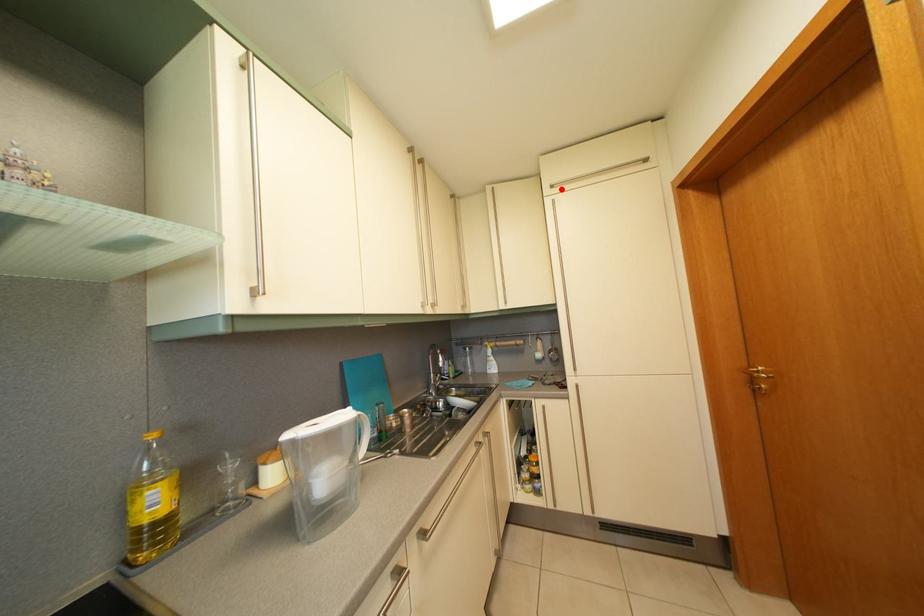
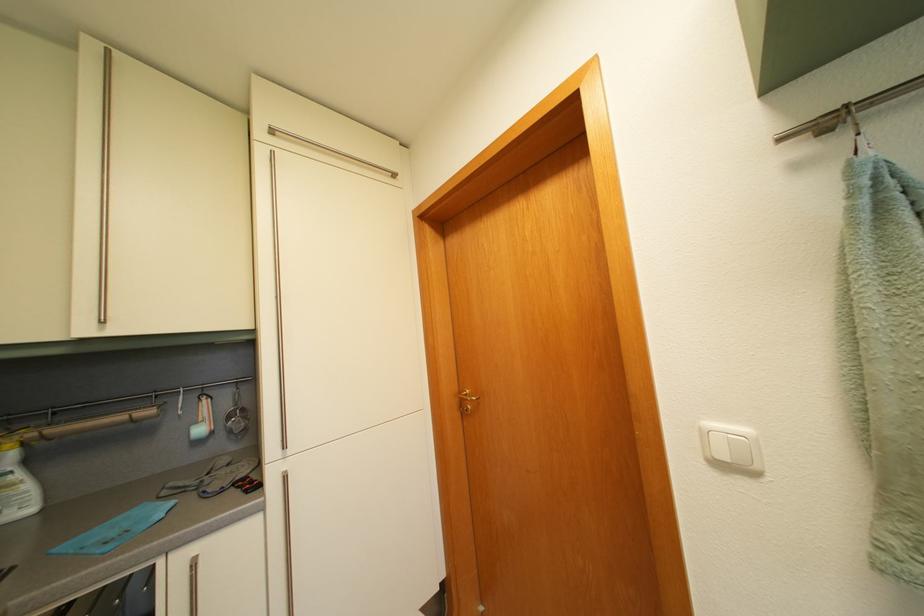
The point at the highlighted location is marked in the first image. Where is the corresponding point in the second image?

(284, 132)